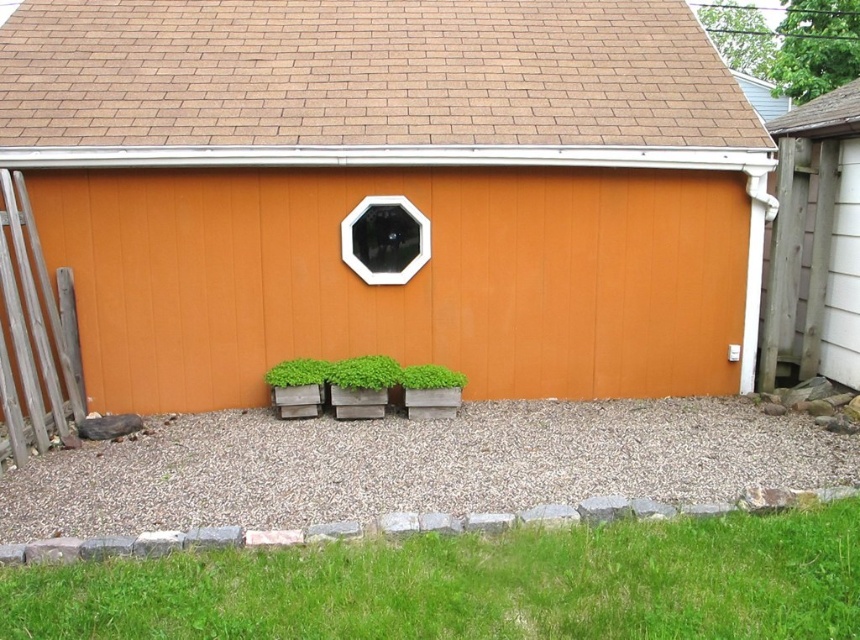
Who is more forward, (112, 355) or (776, 256)?

Point (112, 355) is more forward.

Is orange wood barn at center above weathered wood shed at right?

Yes, orange wood barn at center is above weathered wood shed at right.

Describe the element at coordinates (390, 189) in the screenshot. This screenshot has height=640, width=860. I see `orange wood barn at center` at that location.

Where is `orange wood barn at center`? The width and height of the screenshot is (860, 640). orange wood barn at center is located at coordinates (390, 189).

Between green grass at lower center and weathered wood shed at right, which one is positioned higher?

Positioned higher is weathered wood shed at right.

Between green grass at lower center and weathered wood shed at right, which one is positioned lower?

green grass at lower center is below.

The image size is (860, 640). Identify the location of green grass at lower center. (473, 586).

At what (x,y) coordinates should I click in order to perform the action: click on green grass at lower center. Please return your answer as a coordinate pair (x, y). The height and width of the screenshot is (640, 860). Looking at the image, I should click on (473, 586).

Is weathered wood shed at right thinner than green matte planter at center?

No.

Can you confirm if weathered wood shed at right is taller than green matte planter at center?

Yes.

Does point (791, 214) lie in front of point (428, 372)?

No, it is not.

Where is `weathered wood shed at right`? The height and width of the screenshot is (640, 860). weathered wood shed at right is located at coordinates (803, 227).